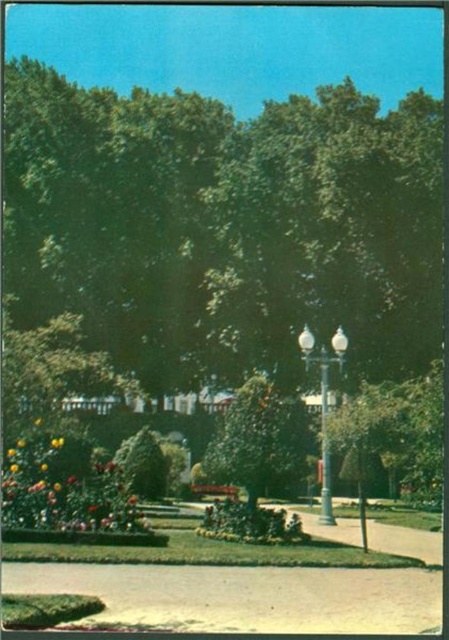
Question: Estimate the real-world distances between objects in this image. Which object is closer to the green leafy bush at center?

Choices:
 (A) glossy yellow flower at center
 (B) glossy floral bouquet at lower left
 (C) metallic pole at center

Answer: (C)

Question: Which is farther from the yellow matte flower at lower left?

Choices:
 (A) polished metal lamp post at center
 (B) glossy yellow flower at center
 (C) green leafy bush at center

Answer: (C)

Question: Can you confirm if metallic pole at center is wider than yellow matte flower at lower left?

Choices:
 (A) no
 (B) yes

Answer: (B)

Question: Does green leafy bush at center come behind metallic pole at center?

Choices:
 (A) no
 (B) yes

Answer: (B)

Question: Observing the image, what is the correct spatial positioning of metallic pole at center in reference to glossy yellow flower at center?

Choices:
 (A) above
 (B) below

Answer: (B)

Question: Which object is positioned closest to the metallic pole at center?

Choices:
 (A) green leafy bush at center
 (B) green leafy tree at center
 (C) glossy floral bouquet at lower left

Answer: (A)